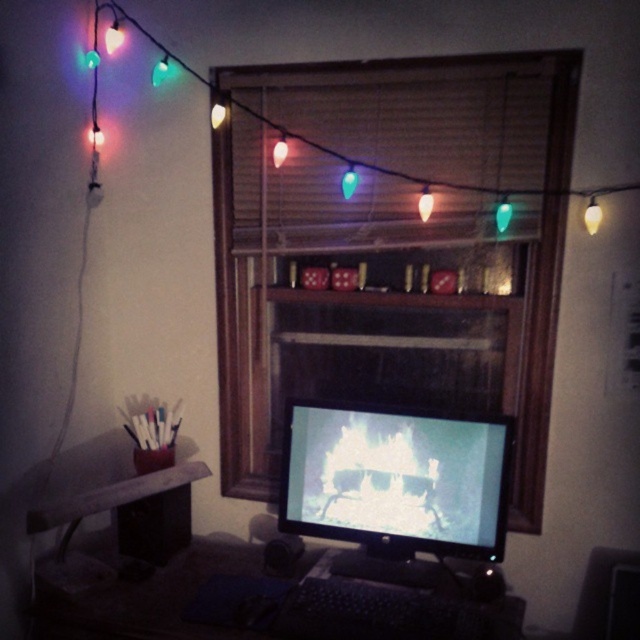
Does point (156, 509) come farther from viewer compared to point (280, 154)?

No, it is in front of (280, 154).

Looking at this image, is wooden at left to the right of green glass bulb at upper center from the viewer's perspective?

No, wooden at left is not to the right of green glass bulb at upper center.

The image size is (640, 640). Identify the location of wooden at left. (131, 508).

Does black plastic keyboard at lower center appear on the left side of green translucent bulb at center?

Yes, black plastic keyboard at lower center is to the left of green translucent bulb at center.

Does black plastic keyboard at lower center appear over green translucent bulb at center?

Incorrect, black plastic keyboard at lower center is not positioned above green translucent bulb at center.

Which is in front, point (170, 612) or point (352, 182)?

Positioned in front is point (170, 612).

Find the location of a particular element. black plastic keyboard at lower center is located at coordinates (154, 589).

From the picture: Does matte black monitor at center appear on the right side of green translucent bulb at center?

Correct, you'll find matte black monitor at center to the right of green translucent bulb at center.

Who is more distant from viewer, (321, 419) or (349, 180)?

Positioned behind is point (321, 419).

I want to click on matte black monitor at center, so click(396, 477).